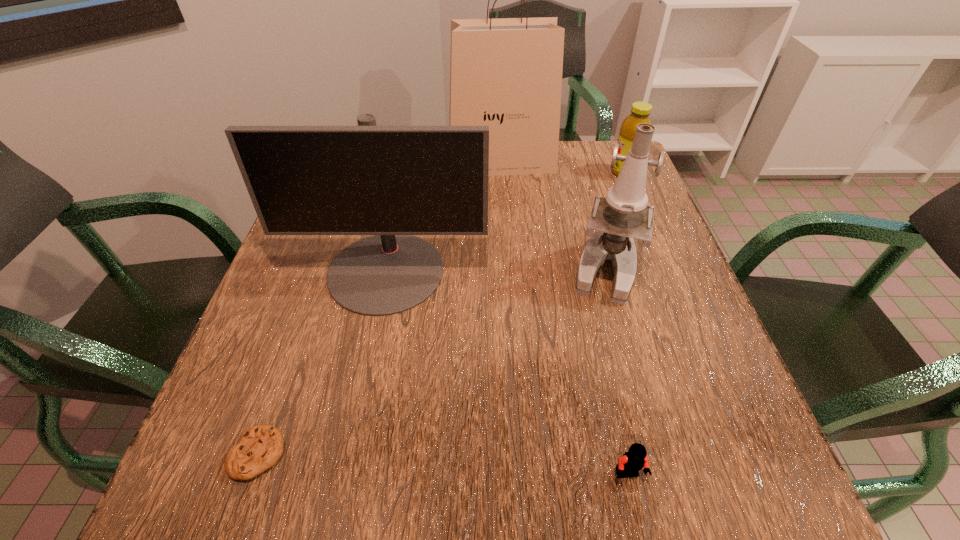
You are a GUI agent. You are given a task and a screenshot of the screen. Output one action in this format:
    pyautogui.click(x=<x>, y=<y>)
    Task: Click on the vacant point located between the rightmost object and the fifth tallest object
    
    Given the screenshot: What is the action you would take?
    pos(626,323)

The height and width of the screenshot is (540, 960). In order to click on free spot between the tallest object and the fourth tallest object in this screenshot , I will do `click(563, 167)`.

The height and width of the screenshot is (540, 960). In order to click on free point between the shopping bag and the second shortest object in this screenshot , I will do `click(564, 319)`.

This screenshot has height=540, width=960. I want to click on free spot between the fruit juice and the tallest object, so click(563, 167).

The image size is (960, 540). Find the location of `blank region between the Lego and the computer monitor`. blank region between the Lego and the computer monitor is located at coordinates (507, 373).

Identify the location of free space between the rightmost object and the shopping bag. The image size is (960, 540). (563, 167).

Locate which object ranks second in proximity to the rightmost object. Please provide its 2D coordinates. Your answer should be formatted as a tuple, i.e. [(x, y)], where the tuple contains the x and y coordinates of a point satisfying the conditions above.

[(624, 214)]

Choose which object is the second nearest neighbor to the tallest object. Please provide its 2D coordinates. Your answer should be formatted as a tuple, i.e. [(x, y)], where the tuple contains the x and y coordinates of a point satisfying the conditions above.

[(392, 182)]

The image size is (960, 540). I want to click on vacant space that satisfies the following two spatial constraints: 1. on the front label of the third shortest object; 2. on the front-facing side of the Lego, so click(x=749, y=475).

Image resolution: width=960 pixels, height=540 pixels. In order to click on free location that satisfies the following two spatial constraints: 1. on the front label of the rightmost object; 2. on the front side of the microscope in this screenshot , I will do `click(664, 268)`.